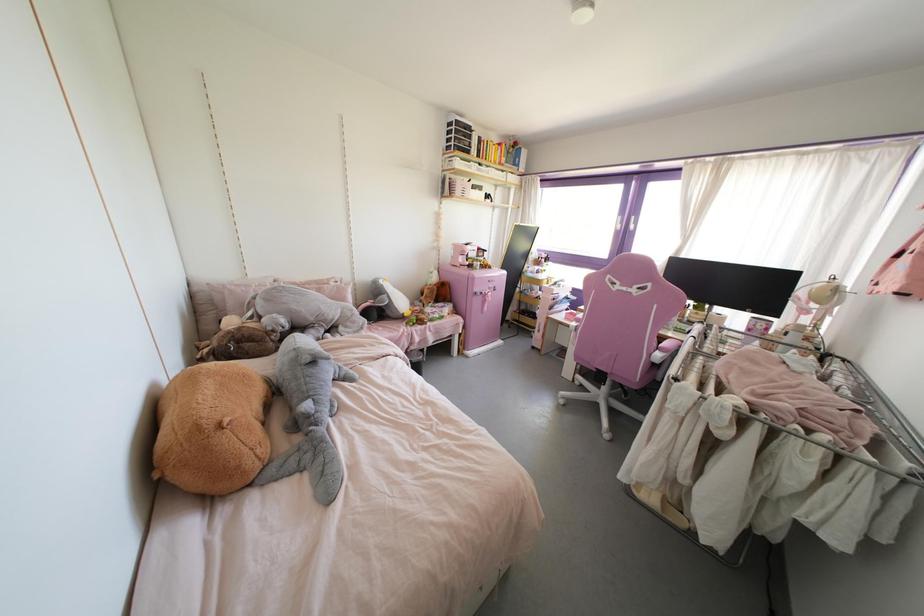
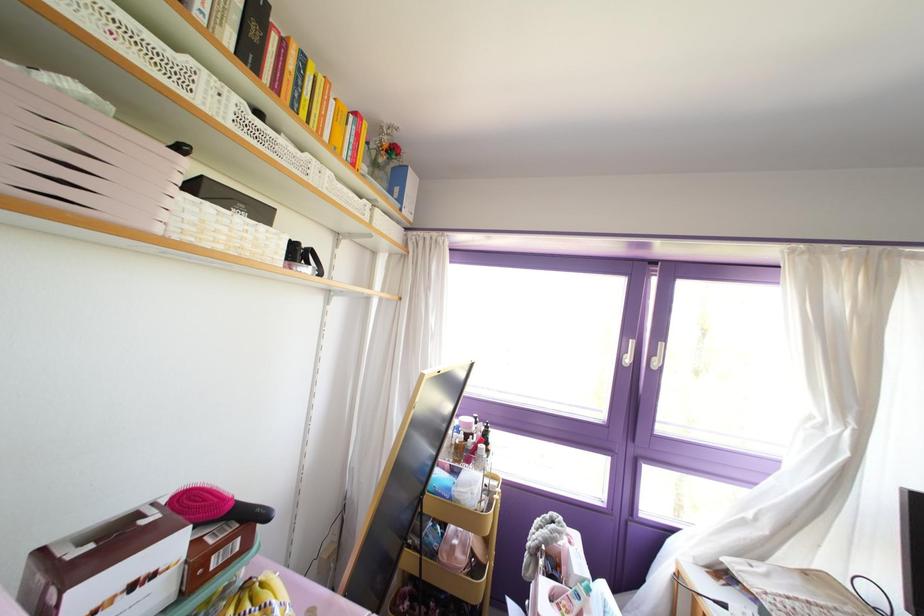
Locate, in the second image, the point that corresponds to the point at 477,191 in the first image.

(237, 219)